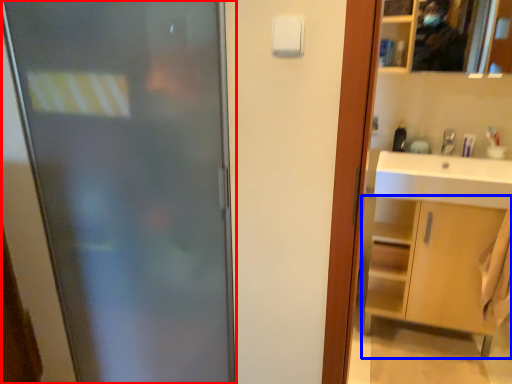
Question: Which of the following is the farthest to the observer, door (highlighted by a red box) or bathroom cabinet (highlighted by a blue box)?

Choices:
 (A) door
 (B) bathroom cabinet

Answer: (B)